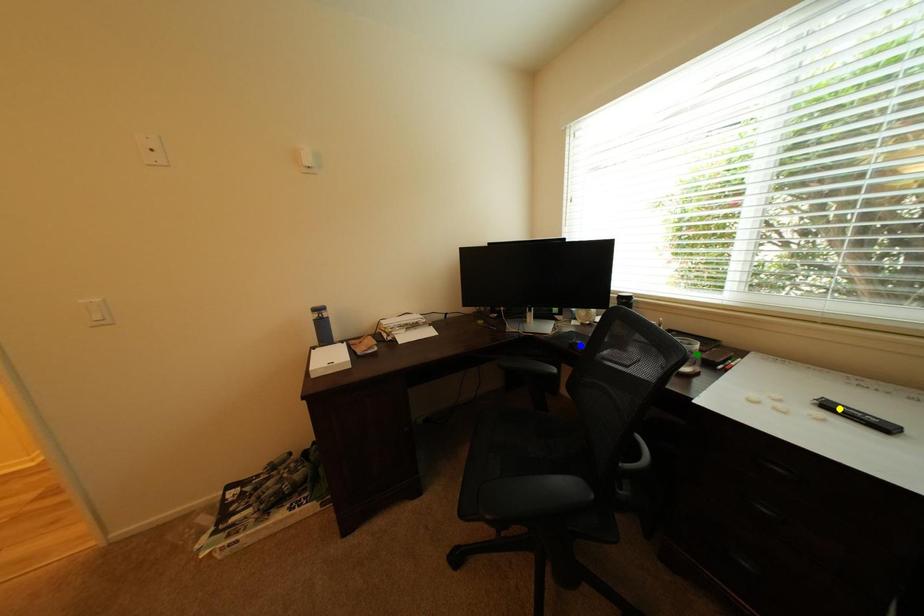
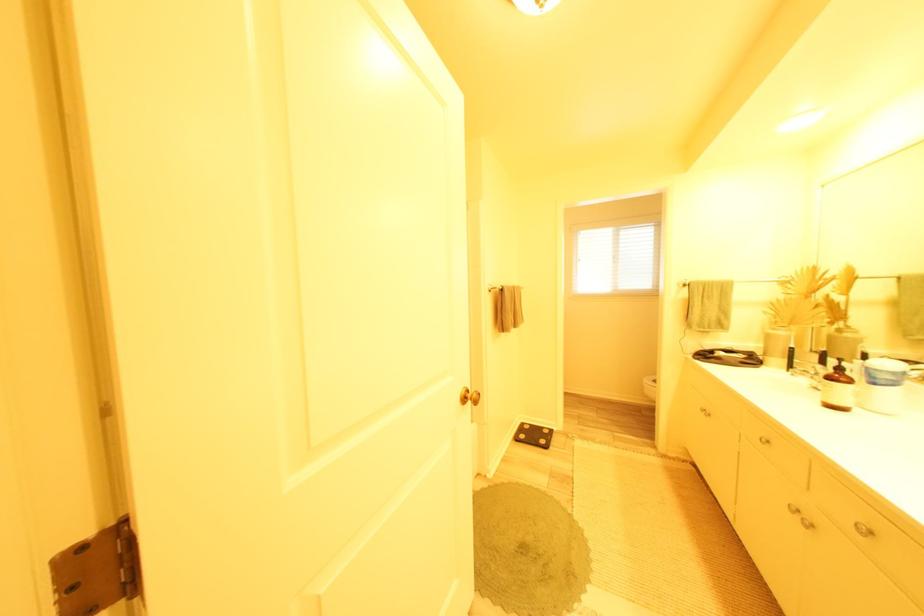
I am providing you with two images of the same scene from different viewpoints. Three points are marked in image1. Which point corresponds to a part or object that is occluded in image2?In image1, three points are marked. Which of them correspond to a part or object that is occluded in image2?Among the three points shown in image1, which one corresponds to a part or object that is no longer visible due to occlusion in image2?

yellow point, blue point, green point